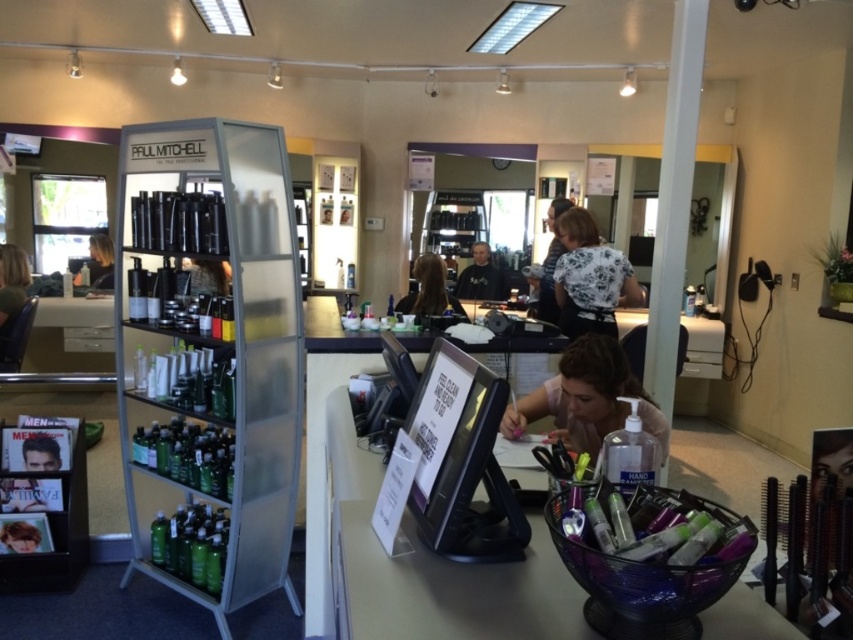
Question: Which object appears farthest from the camera in this image?

Choices:
 (A) blonde hair at left
 (B) green matte hair product at lower left
 (C) white floral blouse at center

Answer: (A)

Question: Can you confirm if blonde hair at left is positioned below green matte hair product at lower left?

Choices:
 (A) no
 (B) yes

Answer: (A)

Question: Considering the real-world distances, which object is farthest from the white floral blouse at center?

Choices:
 (A) black hair at center
 (B) green matte hair product at lower left

Answer: (B)

Question: Which of the following is the farthest from the observer?

Choices:
 (A) black hair at center
 (B) blonde hair at center

Answer: (A)

Question: Is white floral blouse at center thinner than black hair at center?

Choices:
 (A) no
 (B) yes

Answer: (A)

Question: Is white floral blouse at center thinner than green matte hair product at lower left?

Choices:
 (A) no
 (B) yes

Answer: (A)